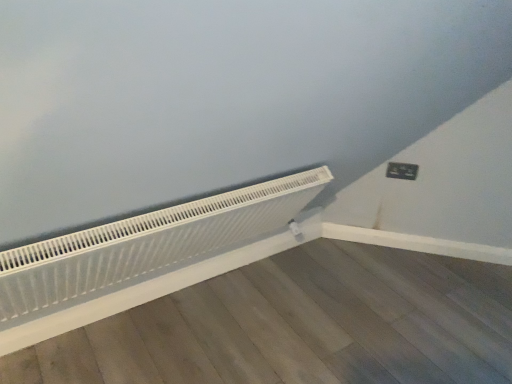
Locate an element on the screen. Image resolution: width=512 pixels, height=384 pixels. white matte radiator at lower left is located at coordinates (147, 244).

The height and width of the screenshot is (384, 512). What do you see at coordinates (147, 244) in the screenshot?
I see `white matte radiator at lower left` at bounding box center [147, 244].

The image size is (512, 384). What do you see at coordinates (402, 171) in the screenshot?
I see `black plastic electric outlet at upper right` at bounding box center [402, 171].

Find the location of a particular element. This screenshot has width=512, height=384. black plastic electric outlet at upper right is located at coordinates (402, 171).

Locate an element on the screen. The height and width of the screenshot is (384, 512). white matte radiator at lower left is located at coordinates (147, 244).

Is white matte radiator at lower left to the right of black plastic electric outlet at upper right from the viewer's perspective?

No, white matte radiator at lower left is not to the right of black plastic electric outlet at upper right.

Which object is more forward, white matte radiator at lower left or black plastic electric outlet at upper right?

white matte radiator at lower left.

Is point (178, 248) positioned before point (394, 172)?

Yes, it is in front of point (394, 172).

From the image's perspective, is white matte radiator at lower left positioned above or below black plastic electric outlet at upper right?

white matte radiator at lower left is below black plastic electric outlet at upper right.

From a real-world perspective, who is located lower, white matte radiator at lower left or black plastic electric outlet at upper right?

In real-world perspective, white matte radiator at lower left is lower.

Which object is thinner, white matte radiator at lower left or black plastic electric outlet at upper right?

With smaller width is black plastic electric outlet at upper right.

Between white matte radiator at lower left and black plastic electric outlet at upper right, which one has more height?

Result: Standing taller between the two is white matte radiator at lower left.

Is white matte radiator at lower left smaller than black plastic electric outlet at upper right?

Actually, white matte radiator at lower left might be larger than black plastic electric outlet at upper right.

Would you say white matte radiator at lower left contains black plastic electric outlet at upper right?

That's incorrect, black plastic electric outlet at upper right is not inside white matte radiator at lower left.

Would you consider white matte radiator at lower left to be distant from black plastic electric outlet at upper right?

white matte radiator at lower left is far away from black plastic electric outlet at upper right.

Is white matte radiator at lower left facing towards black plastic electric outlet at upper right?

No, white matte radiator at lower left does not turn towards black plastic electric outlet at upper right.

Locate an element on the screen. This screenshot has width=512, height=384. electric outlet lying on the right of white matte radiator at lower left is located at coordinates (402, 171).

Considering the positions of objects black plastic electric outlet at upper right and white matte radiator at lower left in the image provided, who is more to the left, black plastic electric outlet at upper right or white matte radiator at lower left?

white matte radiator at lower left.

Considering the positions of objects black plastic electric outlet at upper right and white matte radiator at lower left in the image provided, who is in front, black plastic electric outlet at upper right or white matte radiator at lower left?

Positioned in front is white matte radiator at lower left.

Does point (411, 178) come farther from viewer compared to point (139, 238)?

Yes, it is.

From the image's perspective, who appears lower, black plastic electric outlet at upper right or white matte radiator at lower left?

white matte radiator at lower left appears lower in the image.

In the scene shown: From a real-world perspective, is black plastic electric outlet at upper right physically below white matte radiator at lower left?

Actually, black plastic electric outlet at upper right is physically above white matte radiator at lower left in the real world.

Considering the relative sizes of black plastic electric outlet at upper right and white matte radiator at lower left in the image provided, is black plastic electric outlet at upper right thinner than white matte radiator at lower left?

Yes.

Who is shorter, black plastic electric outlet at upper right or white matte radiator at lower left?

Standing shorter between the two is black plastic electric outlet at upper right.

In terms of size, does black plastic electric outlet at upper right appear bigger or smaller than white matte radiator at lower left?

Clearly, black plastic electric outlet at upper right is smaller in size than white matte radiator at lower left.

Is black plastic electric outlet at upper right completely or partially outside of white matte radiator at lower left?

That's correct, black plastic electric outlet at upper right is outside of white matte radiator at lower left.

Is the surface of black plastic electric outlet at upper right in direct contact with white matte radiator at lower left?

black plastic electric outlet at upper right and white matte radiator at lower left are not in contact.

Is black plastic electric outlet at upper right turned away from white matte radiator at lower left?

No, white matte radiator at lower left is not at the back of black plastic electric outlet at upper right.

Can you tell me how much black plastic electric outlet at upper right and white matte radiator at lower left differ in facing direction?

45.2 degrees.

Measure the distance between black plastic electric outlet at upper right and white matte radiator at lower left.

A distance of 1.21 meters exists between black plastic electric outlet at upper right and white matte radiator at lower left.

Where is `electric outlet on the right side of white matte radiator at lower left`? Image resolution: width=512 pixels, height=384 pixels. electric outlet on the right side of white matte radiator at lower left is located at coordinates (402, 171).

Where is `heater that appears below the black plastic electric outlet at upper right (from the image's perspective)`? The width and height of the screenshot is (512, 384). heater that appears below the black plastic electric outlet at upper right (from the image's perspective) is located at coordinates (147, 244).

You are a GUI agent. You are given a task and a screenshot of the screen. Output one action in this format:
    pyautogui.click(x=<x>, y=<y>)
    Task: Click on the electric outlet located above the white matte radiator at lower left (from the image's perspective)
    The height and width of the screenshot is (384, 512).
    Given the screenshot: What is the action you would take?
    pyautogui.click(x=402, y=171)